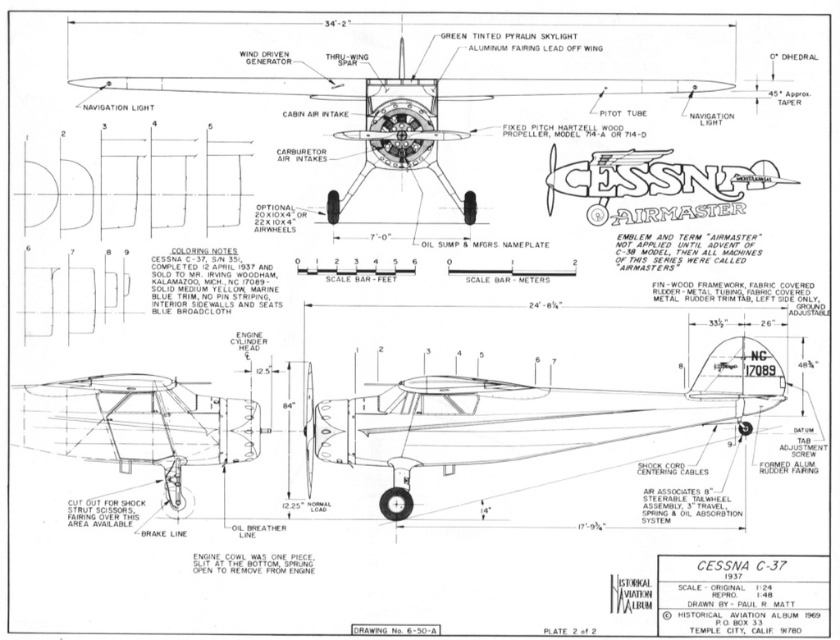
Who is positioned more to the left, matte black propeller at center or metallic silver propeller at center?

metallic silver propeller at center

Is matte black propeller at center closer to camera compared to metallic silver propeller at center?

No, it is not.

Where is `matte black propeller at center`? The image size is (840, 640). matte black propeller at center is located at coordinates (408, 104).

The width and height of the screenshot is (840, 640). I want to click on matte black propeller at center, so pyautogui.click(x=408, y=104).

Which is in front, point (455, 433) or point (423, 150)?

Positioned in front is point (455, 433).

Does matte black airplane at center appear over matte black propeller at center?

Incorrect, matte black airplane at center is not positioned above matte black propeller at center.

Who is more distant from viewer, (458,420) or (463,81)?

The point (458,420) is behind.

The image size is (840, 640). Identify the location of matte black airplane at center. (534, 417).

Who is more distant from viewer, [450,467] or [87,396]?

Point [450,467]

Who is lower down, matte black airplane at center or metallic silver propeller at center?

Positioned lower is metallic silver propeller at center.

Image resolution: width=840 pixels, height=640 pixels. Identify the location of matte black airplane at center. (534, 417).

I want to click on matte black airplane at center, so click(x=534, y=417).